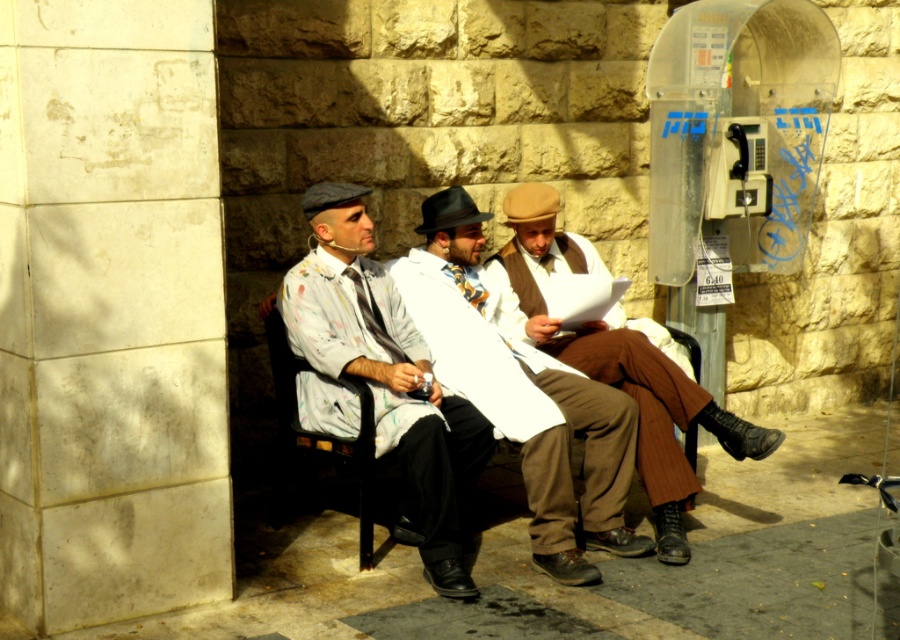
Question: Is white cotton coat at center positioned behind metallic gray payphone at upper right?

Choices:
 (A) yes
 (B) no

Answer: (B)

Question: Is the position of paint-splattered shirt at center more distant than that of metallic gray payphone at upper right?

Choices:
 (A) yes
 (B) no

Answer: (B)

Question: Does white cotton coat at center have a smaller size compared to metallic gray payphone at upper right?

Choices:
 (A) no
 (B) yes

Answer: (A)

Question: Among these points, which one is nearest to the camera?

Choices:
 (A) (576, 392)
 (B) (731, 131)

Answer: (A)

Question: Which object is the closest to the metallic gray payphone at upper right?

Choices:
 (A) paint-splattered shirt at center
 (B) white cotton coat at center
 (C) brown woolen vest at center

Answer: (C)

Question: Estimate the real-world distances between objects in this image. Which object is closer to the brown woolen vest at center?

Choices:
 (A) metallic gray payphone at upper right
 (B) white cotton coat at center
 (C) paint-splattered shirt at center

Answer: (B)